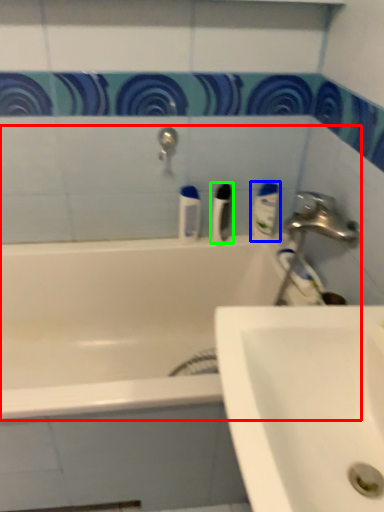
Question: Based on their relative distances, which object is nearer to bathtub (highlighted by a red box)? Choose from mouthwash (highlighted by a blue box) and toiletry (highlighted by a green box).

Choices:
 (A) mouthwash
 (B) toiletry

Answer: (B)